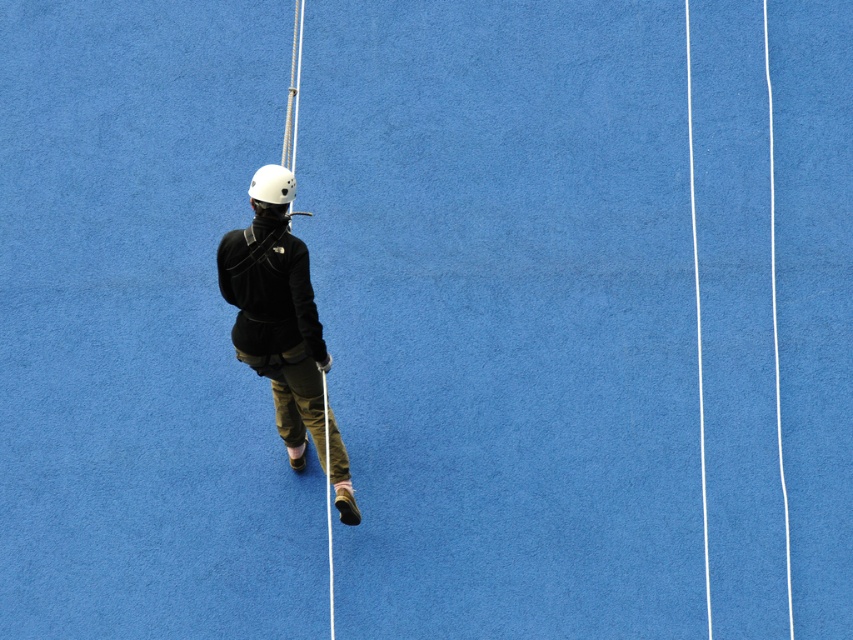
You are a safety inspector checking the rappelling setup. You notice the white matte helmet at center and the matte black jacket at center. Based on their positions, which object is closer to the observer?

The matte black jacket at center is closer to the observer because the white matte helmet at center is positioned behind it.

You are an instructor assessing a participant in a rappelling activity. You notice the participant is wearing a matte black jacket at center and holding a matte black ski pole at center. Which object is more likely to be visible to someone standing directly below the participant?

The matte black jacket at center has a larger size compared to the matte black ski pole at center, so the matte black jacket at center would be more visible to someone standing directly below the participant.

You are a safety inspector checking the rappelling setup. The point representing the matte black jacket at center is at coordinates [276,310]. The ropes are along the right side. Is the jacket positioned to the left or right of the ropes?

The matte black jacket at center is represented by point [276,310], which is to the left of the ropes along the right side.